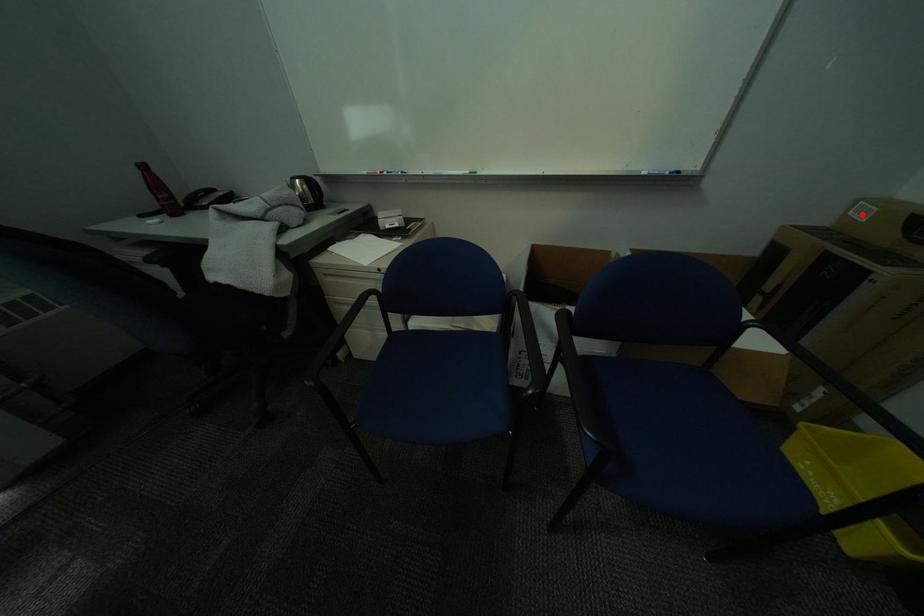
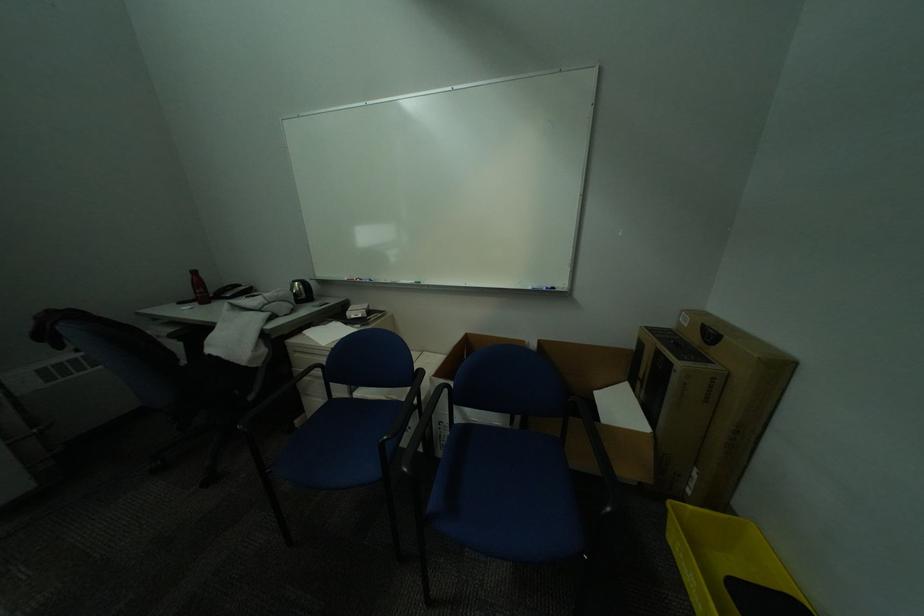
Find the pixel in the second image that matches the highlighted location in the first image.

(691, 321)